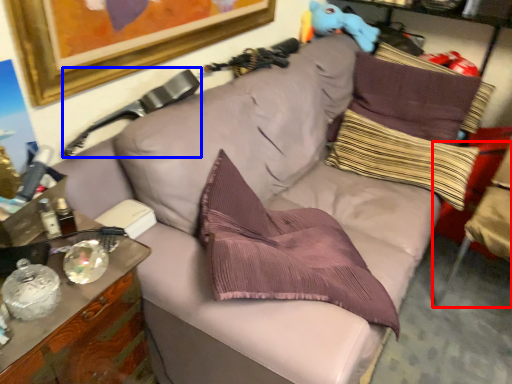
Question: Which object appears closest to the camera in this image, swivel chair (highlighted by a red box) or swivel chair (highlighted by a blue box)?

Choices:
 (A) swivel chair
 (B) swivel chair

Answer: (B)